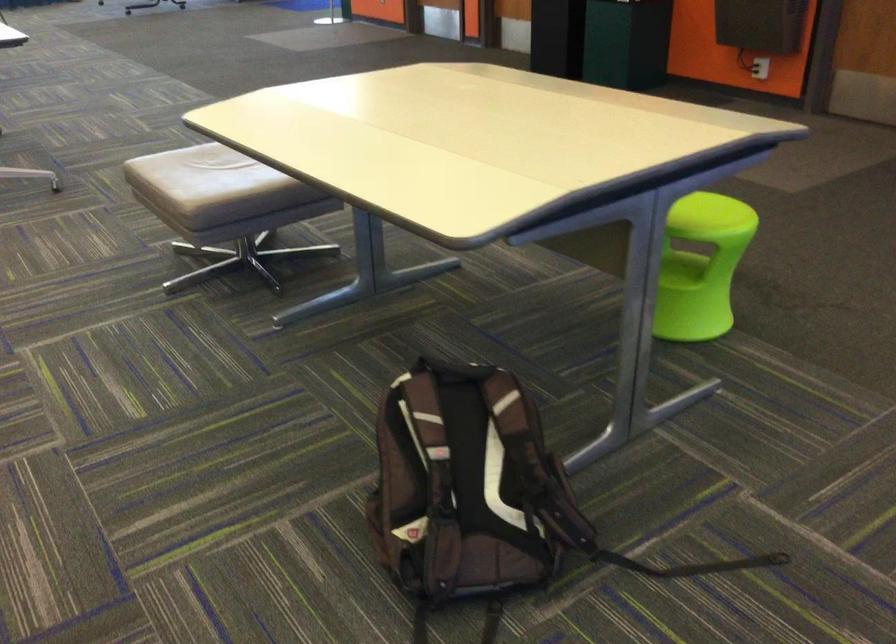
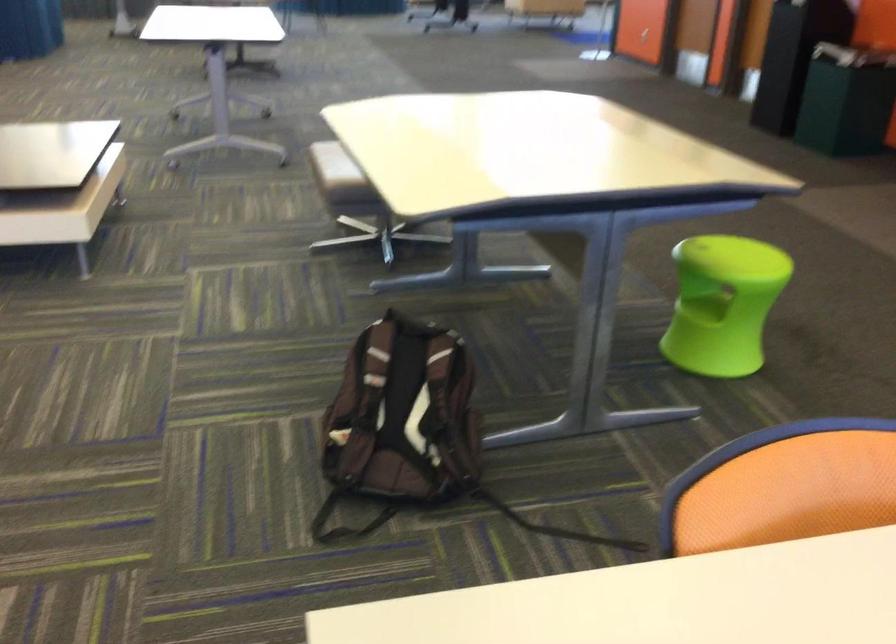
In the second image, find the point that corresponds to point (669, 270) in the first image.

(702, 307)